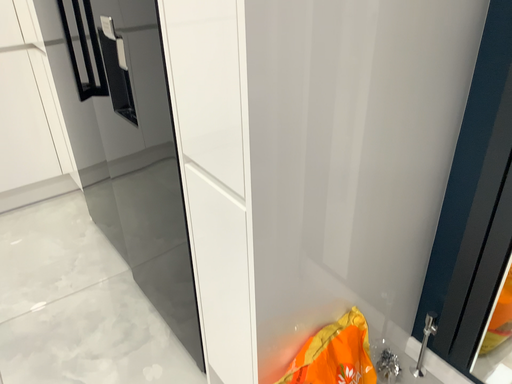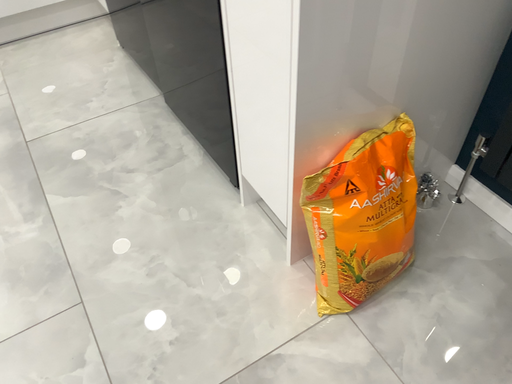
Question: How did the camera likely rotate when shooting the video?

Choices:
 (A) rotated downward
 (B) rotated upward

Answer: (A)